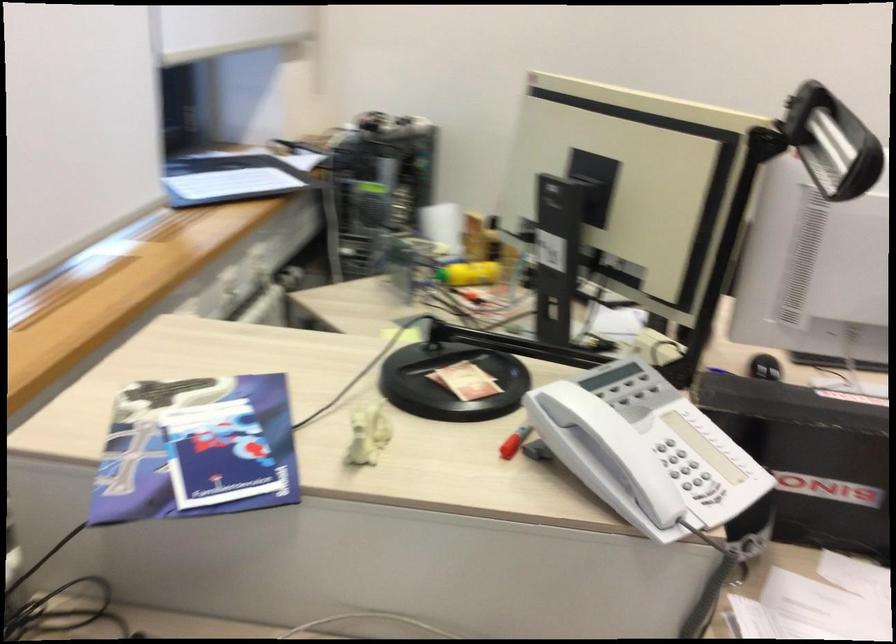
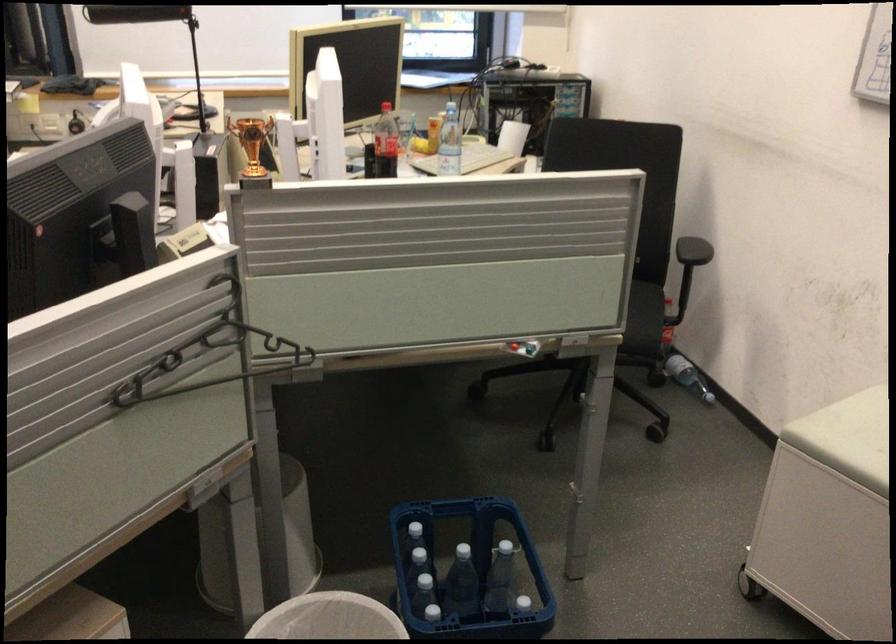
Question: I am providing you with two images of the same scene from different viewpoints. Please identify which objects are invisible in image2.

Choices:
 (A) coca-cola bottle
 (B) red marker
 (C) large black stapler
 (D) black clothes hanger

Answer: (B)